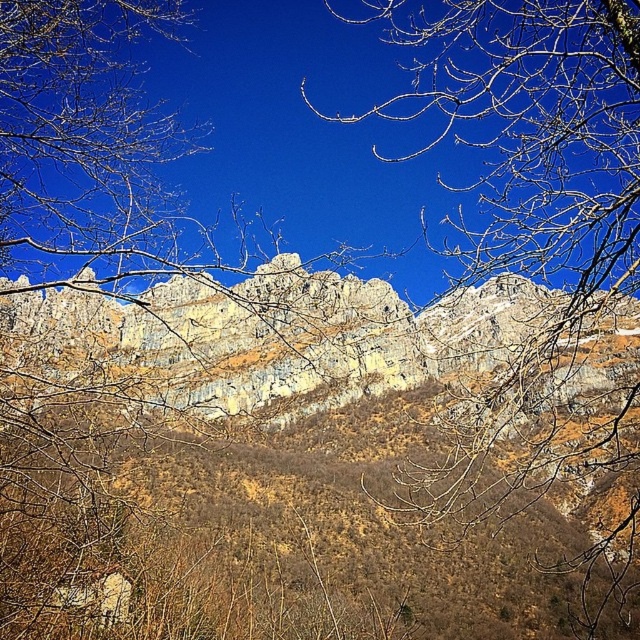
Is bare branches at upper center shorter than rugged stone mountain at center?

Incorrect, bare branches at upper center's height does not fall short of rugged stone mountain at center's.

Does point (490, 234) come closer to viewer compared to point (556, 298)?

Yes, it is.

Does point (394, 116) come in front of point (484, 298)?

No.

Image resolution: width=640 pixels, height=640 pixels. What are the coordinates of `bare branches at upper center` in the screenshot? It's located at (532, 189).